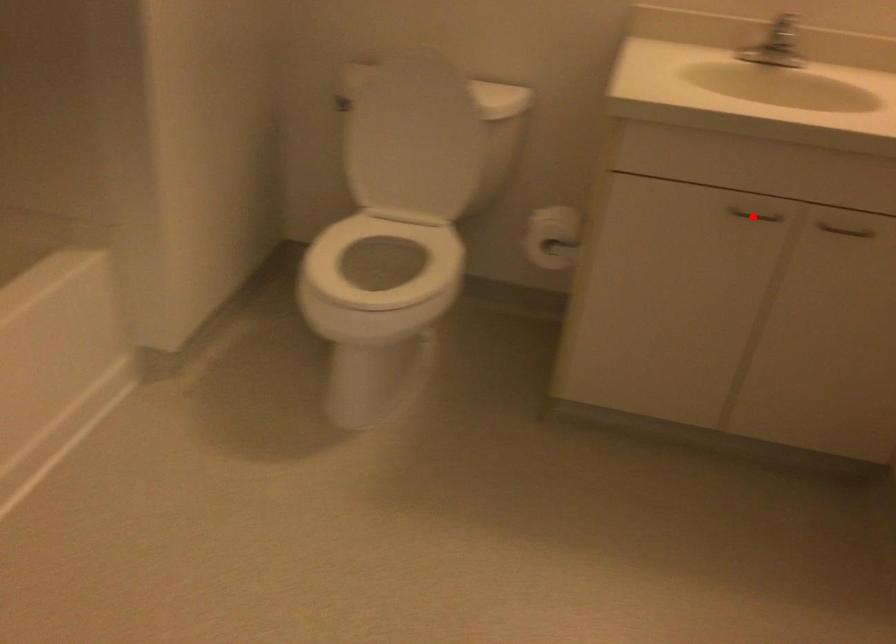
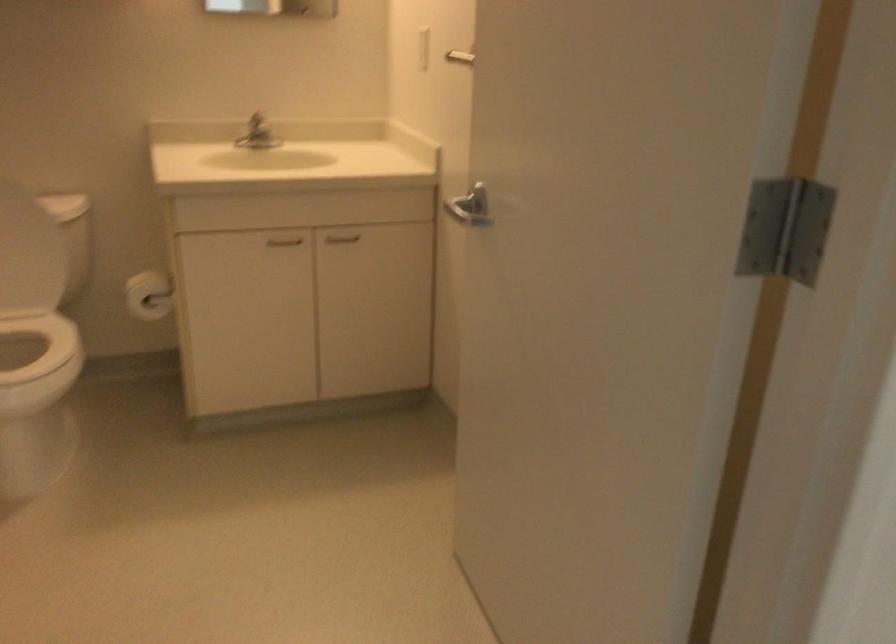
Question: A red point is marked in image1. In image2, is the corresponding 3D point closer to the camera or farther? Reply with the corresponding letter.

Choices:
 (A) The corresponding 3D point is closer.
 (B) The corresponding 3D point is farther.

Answer: (B)